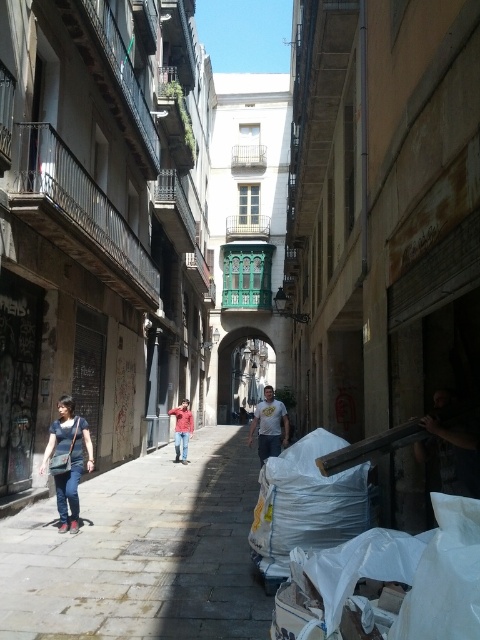
Question: Among these objects, which one is nearest to the camera?

Choices:
 (A) denim jeans at lower left
 (B) red denim jeans at center
 (C) gray stone pavement at center

Answer: (C)

Question: Which of these objects is positioned closest to the gray stone pavement at center?

Choices:
 (A) denim jeans at lower left
 (B) red denim jeans at center

Answer: (A)

Question: Can you confirm if denim jeans at lower left is positioned below red denim jeans at center?

Choices:
 (A) yes
 (B) no

Answer: (B)

Question: Observing the image, what is the correct spatial positioning of denim jeans at lower left in reference to white t-shirt at center?

Choices:
 (A) below
 (B) above

Answer: (B)

Question: Estimate the real-world distances between objects in this image. Which object is closer to the gray stone pavement at center?

Choices:
 (A) white t-shirt at center
 (B) red denim jeans at center
 (C) denim jeans at lower left

Answer: (C)

Question: Is denim jeans at lower left to the left of white t-shirt at center from the viewer's perspective?

Choices:
 (A) yes
 (B) no

Answer: (A)